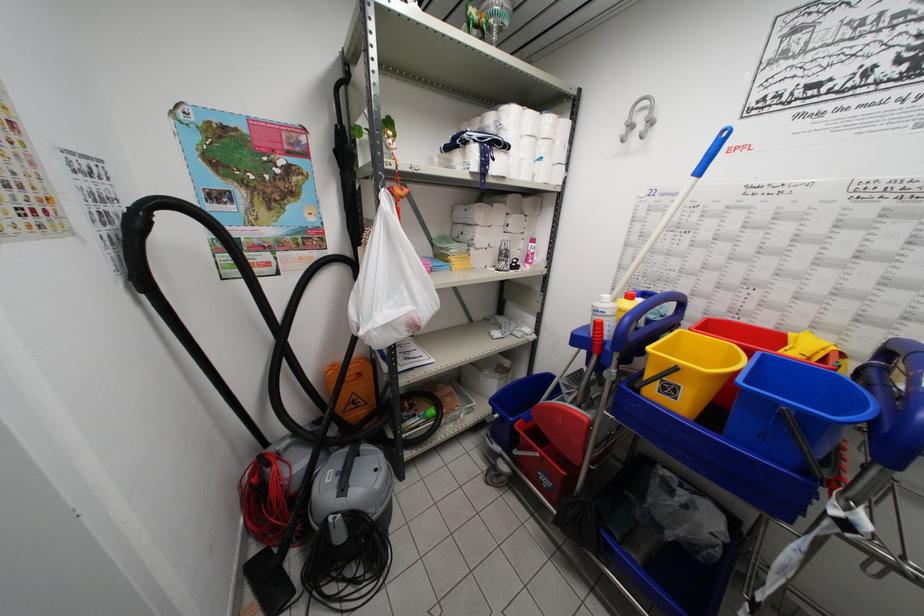
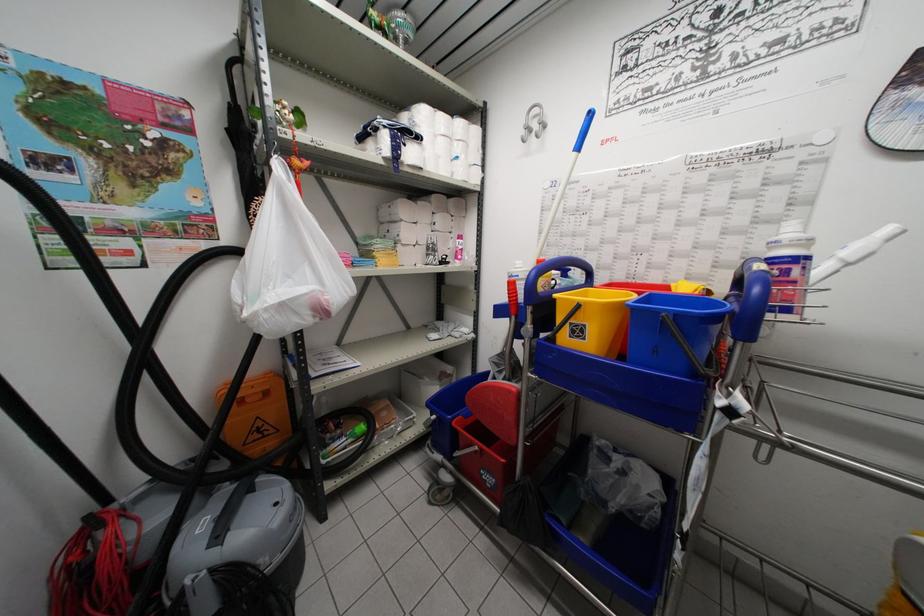
Question: How did the camera likely rotate?

Choices:
 (A) Left
 (B) Right
 (C) Up
 (D) Down

Answer: (B)